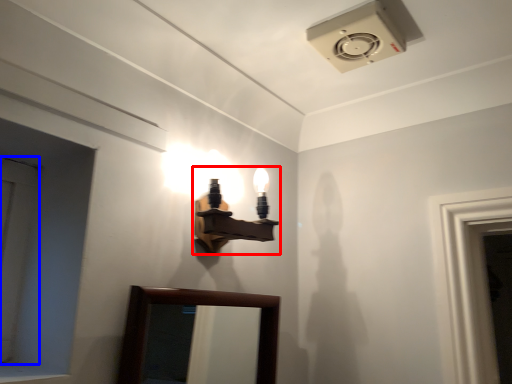
Question: Which point is closer to the camera, lamp (highlighted by a red box) or door (highlighted by a blue box)?

Choices:
 (A) lamp
 (B) door

Answer: (B)